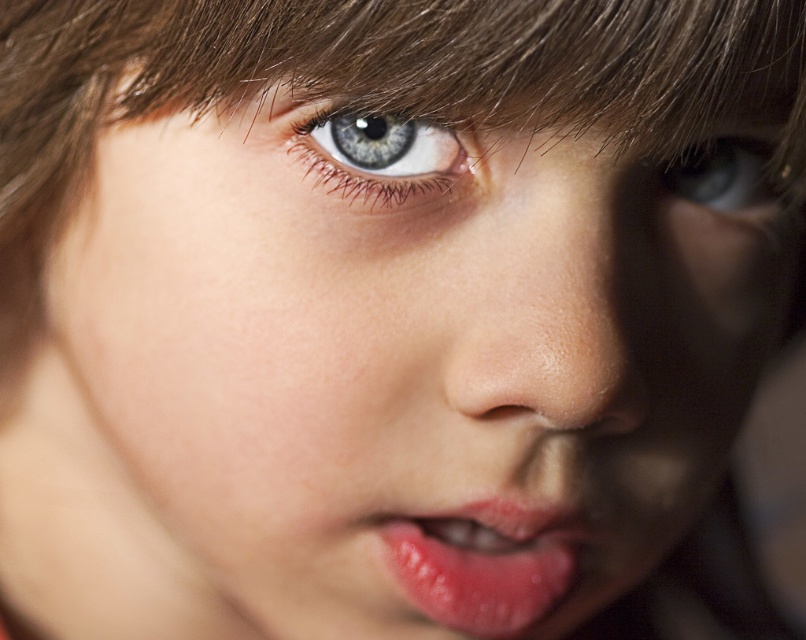
You are an artist trying to sketch the child in the image. You notice the smooth skin nose at center and the blue glossy eye at center. Which object is positioned to the right in the image?

The smooth skin nose at center is positioned to the right of the blue glossy eye at center.

You are an artist trying to draw the child in the image. You want to place the smooth skin nose at center accurately. What are the coordinates for its position?

The smooth skin nose at center is located at coordinates point (541, 300).